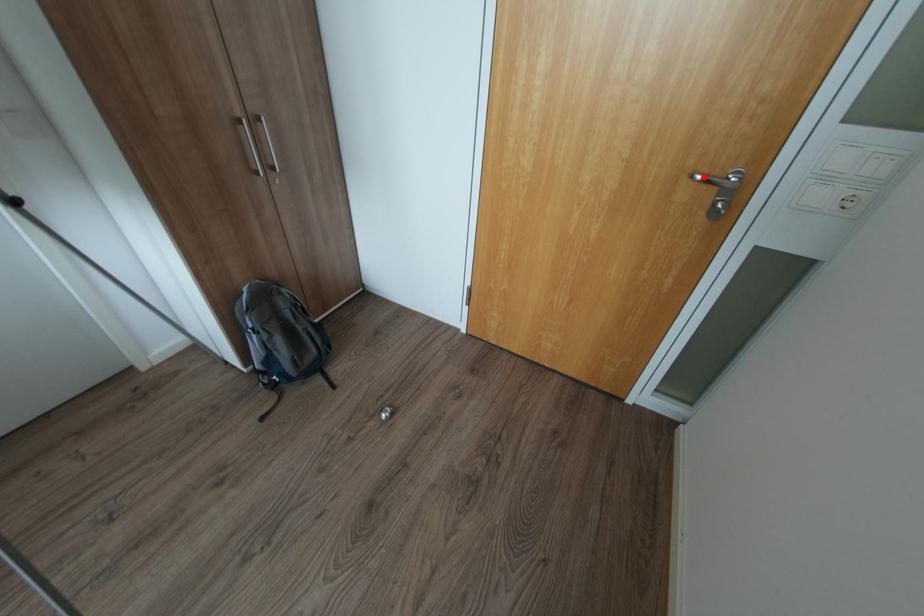
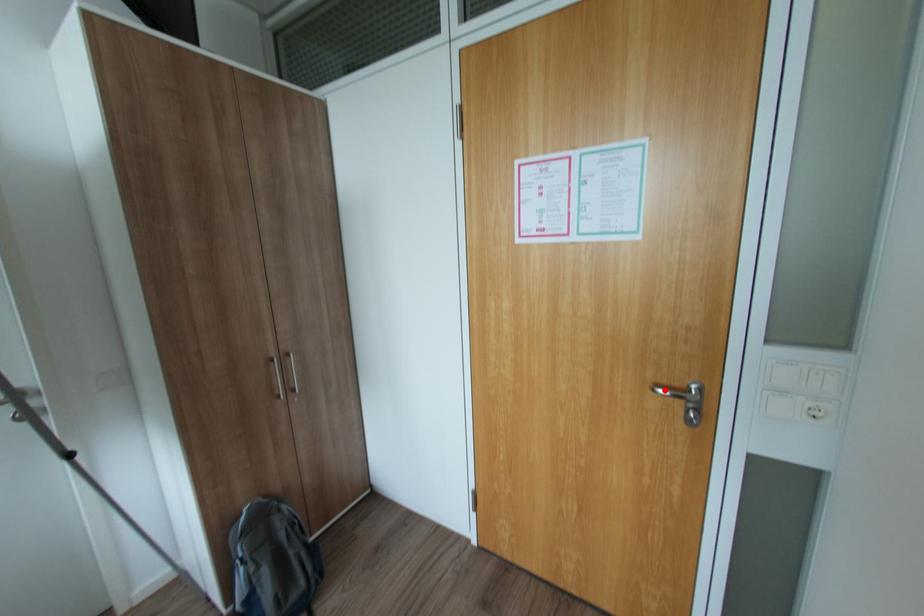
I am providing you with two images of the same scene from different viewpoints. A red point is marked on the first image and another point is marked on the second image. Are the points marked in image1 and image2 representing the same 3D position?

Yes